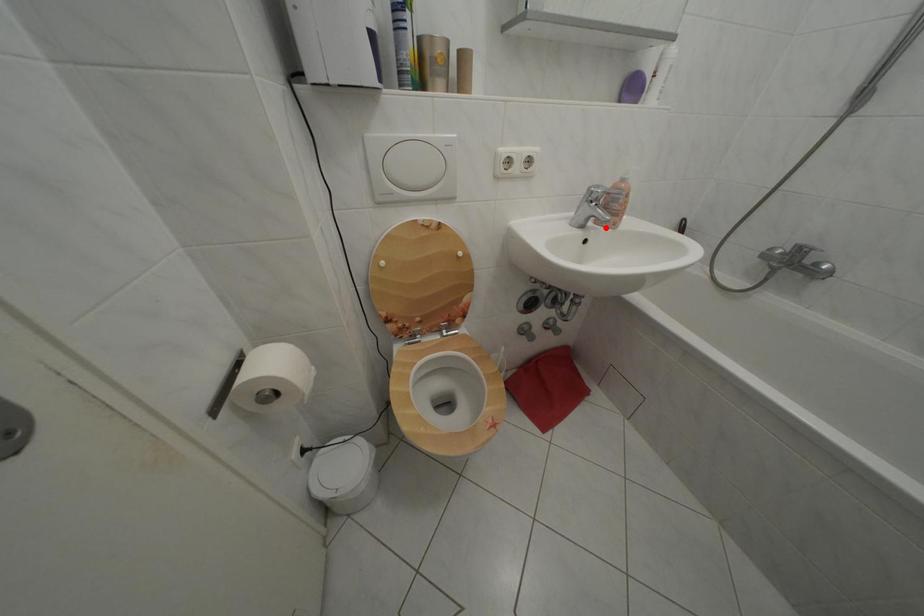
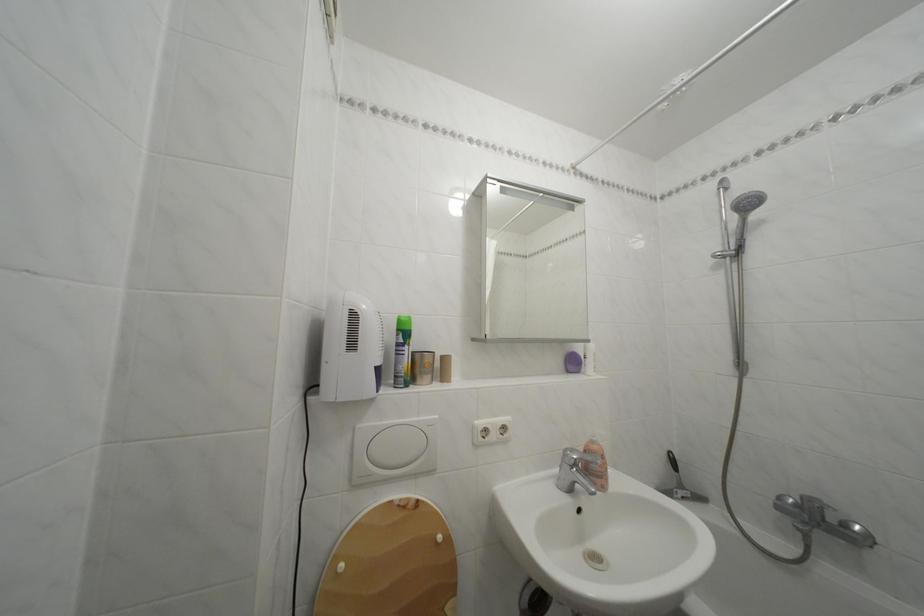
Question: I am providing you with two images of the same scene from different viewpoints. Given a red point in image1, look at the same physical point in image2. Is it:

Choices:
 (A) Closer to the viewpoint
 (B) Farther from the viewpoint

Answer: (B)